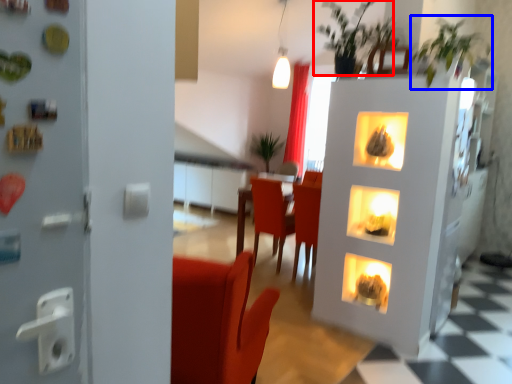
Question: Which of the following is the farthest to the observer, plant (highlighted by a red box) or plant (highlighted by a blue box)?

Choices:
 (A) plant
 (B) plant

Answer: (A)